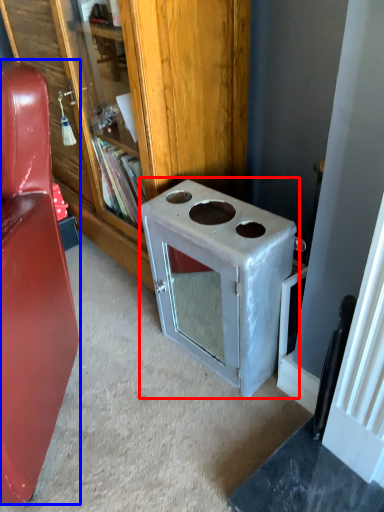
Question: Which object is closer to the camera taking this photo, appliance (highlighted by a red box) or furniture (highlighted by a blue box)?

Choices:
 (A) appliance
 (B) furniture

Answer: (B)